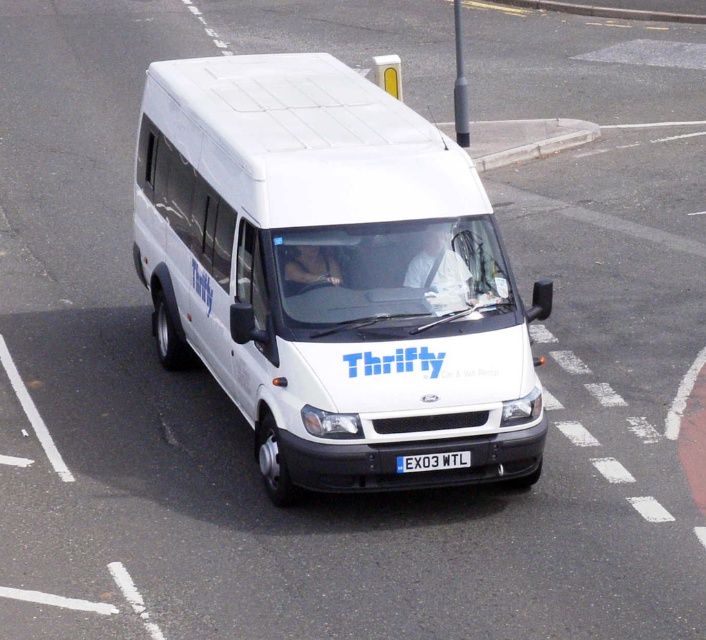
Question: Is white matte van at center wider than white plastic license plate at center?

Choices:
 (A) yes
 (B) no

Answer: (A)

Question: Can you confirm if white matte van at center is positioned below white plastic license plate at center?

Choices:
 (A) yes
 (B) no

Answer: (B)

Question: Which point is closer to the camera taking this photo?

Choices:
 (A) (430, 467)
 (B) (162, 124)

Answer: (A)

Question: Can you confirm if white matte van at center is thinner than white plastic license plate at center?

Choices:
 (A) yes
 (B) no

Answer: (B)